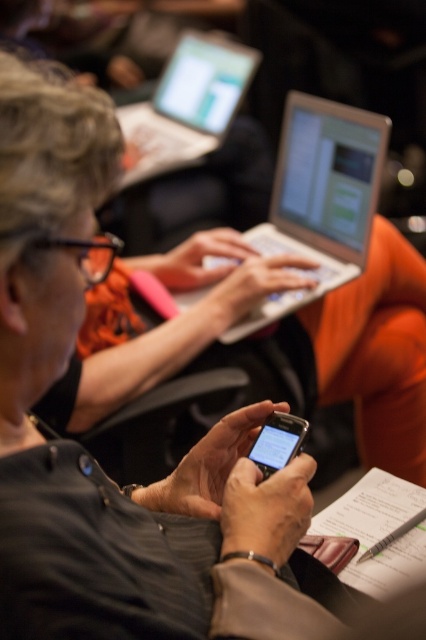
Question: Which object is positioned closest to the matte black smartphone at center?

Choices:
 (A) silver metallic laptop at upper center
 (B) silver metallic laptop at center

Answer: (B)

Question: Does silver metallic laptop at center have a lesser width compared to matte black smartphone at center?

Choices:
 (A) no
 (B) yes

Answer: (A)

Question: Is silver metallic laptop at center smaller than matte black smartphone at center?

Choices:
 (A) yes
 (B) no

Answer: (B)

Question: Does silver metallic laptop at upper center appear over matte black smartphone at center?

Choices:
 (A) no
 (B) yes

Answer: (B)

Question: Which object appears closest to the camera in this image?

Choices:
 (A) silver metallic laptop at upper center
 (B) matte black smartphone at center

Answer: (B)

Question: Which point is closer to the camera?

Choices:
 (A) silver metallic laptop at upper center
 (B) matte black smartphone at center

Answer: (B)